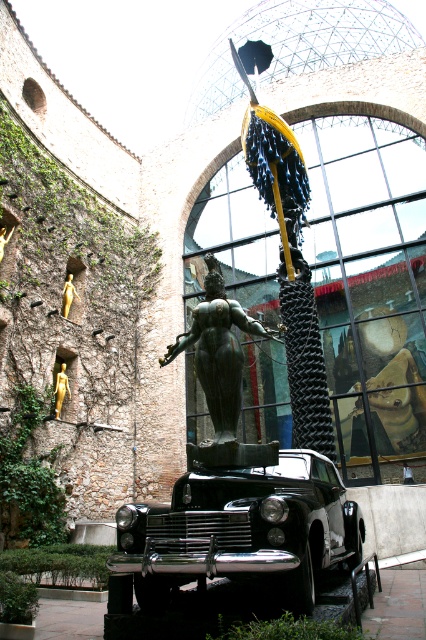
You are a delivery person trying to navigate through the indoor courtyard. You need to place a package between the gold metallic statue at left and the gold metallic statue at upper left. Can you fit the package in the space between them if the package requires 10 meters of space?

The gold metallic statue at left and the gold metallic statue at upper left are 9.25 meters apart, so the package requiring 10 meters of space cannot fit between them. You need to find another location.

You are standing in the indoor courtyard and want to move from the point at coordinates point (327, 557) to the point at coordinates point (66, 289). Based on the scene description, which direction should you move to reach your destination?

To move from point (327, 557) to point (66, 289), you should move towards the lower left direction since point (66, 289) is located to the lower left of point (327, 557).

You are an interior designer planning to place a new decorative item in the indoor courtyard. You have two gold metallic statues available. The first is the gold metallic statue at left and the second is the gold metallic statue at upper left. Based on their sizes, which statue would you recommend placing closer to the entrance to ensure it doesn

The gold metallic statue at upper left is wider than the gold metallic statue at left, so placing the smaller gold metallic statue at left closer to the entrance would be better to avoid blocking the entrance area.